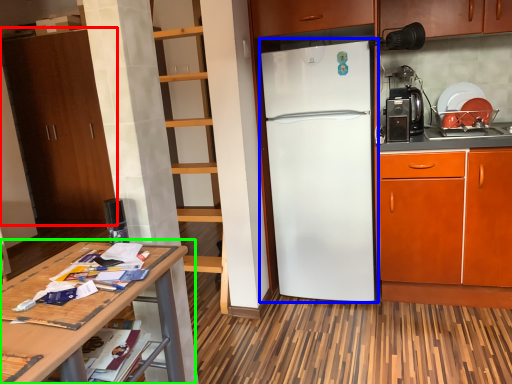
Question: Considering the real-world distances, which object is farthest from cabinetry (highlighted by a red box)? refrigerator (highlighted by a blue box) or table (highlighted by a green box)?

Choices:
 (A) refrigerator
 (B) table

Answer: (B)